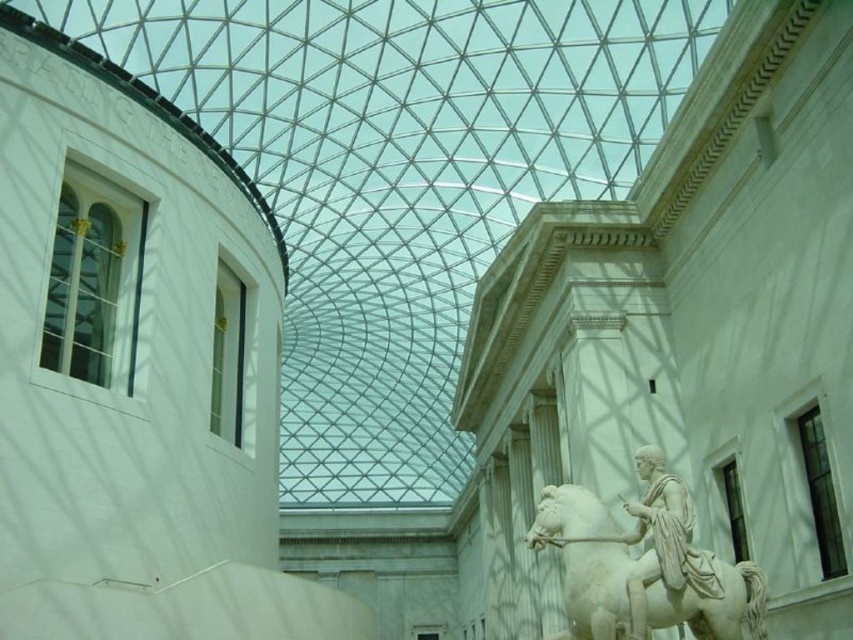
Does white marble horse at center-right have a lesser height compared to white marble statue at center-right?

In fact, white marble horse at center-right may be taller than white marble statue at center-right.

Can you confirm if white marble horse at center-right is smaller than white marble statue at center-right?

Incorrect, white marble horse at center-right is not smaller in size than white marble statue at center-right.

Locate an element on the screen. This screenshot has height=640, width=853. white marble horse at center-right is located at coordinates (585, 561).